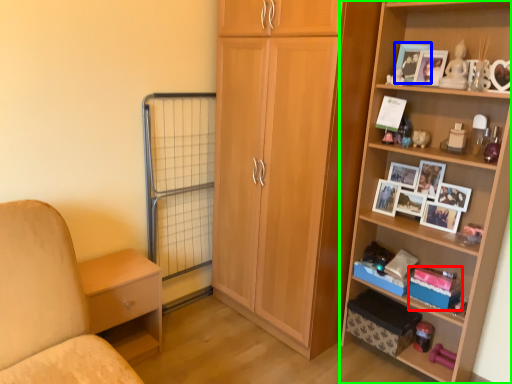
Question: Which is farther away from storage box (highlighted by a red box)? picture frame (highlighted by a blue box) or shelf (highlighted by a green box)?

Choices:
 (A) picture frame
 (B) shelf

Answer: (A)